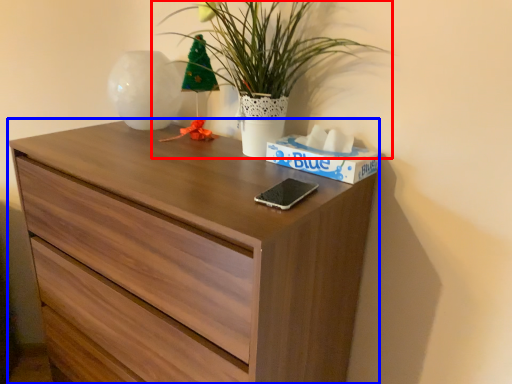
Question: Which object is further to the camera taking this photo, houseplant (highlighted by a red box) or chest of drawers (highlighted by a blue box)?

Choices:
 (A) houseplant
 (B) chest of drawers

Answer: (A)